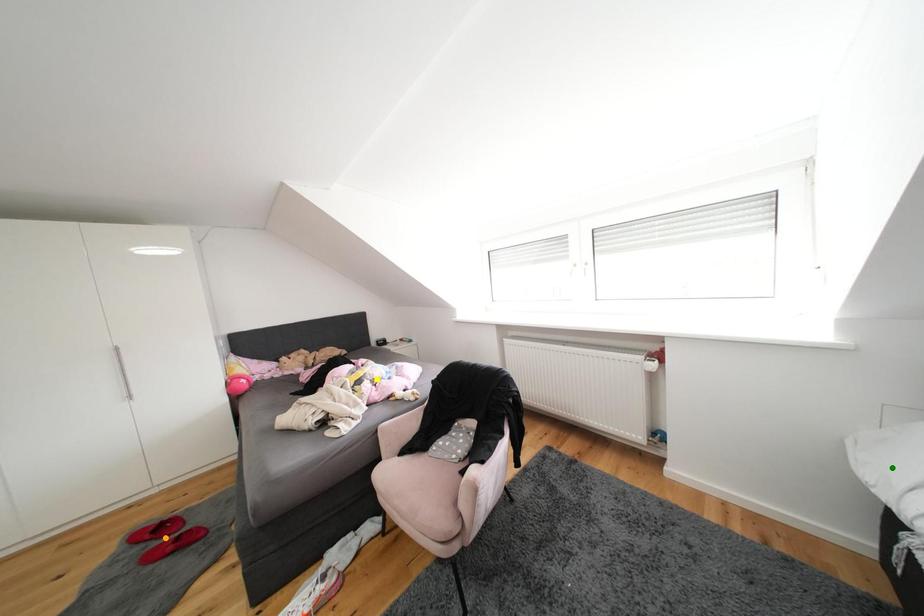
Order these from farthest to nearest:
green point
yellow point
orange point

1. yellow point
2. orange point
3. green point